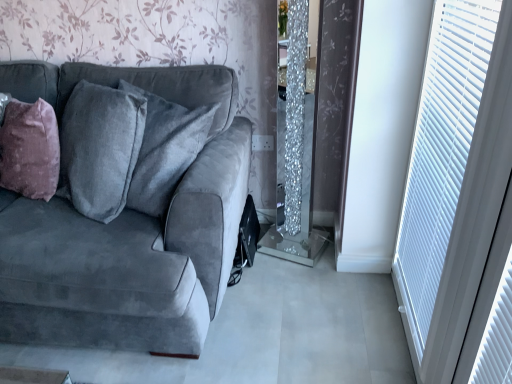
This screenshot has height=384, width=512. I want to click on white plastic blinds at right, so click(455, 175).

The height and width of the screenshot is (384, 512). I want to click on mauve velvet throw pillow at left, so click(x=30, y=149).

Is velvet gray couch at left taller than mauve velvet throw pillow at left?

Yes.

From the picture: From the image's perspective, which is below, velvet gray couch at left or mauve velvet throw pillow at left?

velvet gray couch at left.

Could you tell me if velvet gray couch at left is turned towards mauve velvet throw pillow at left?

No, velvet gray couch at left is not turned towards mauve velvet throw pillow at left.

From a real-world perspective, relative to mauve velvet throw pillow at left, is velvet gray couch at left vertically above or below?

velvet gray couch at left is below mauve velvet throw pillow at left.

Locate an element on the screen. This screenshot has width=512, height=384. studio couch on the left side of white plastic blinds at right is located at coordinates (127, 232).

From the picture: Is white plastic blinds at right at the left side of velvet gray couch at left?

Incorrect, white plastic blinds at right is not on the left side of velvet gray couch at left.

Based on their sizes in the image, would you say white plastic blinds at right is bigger or smaller than velvet gray couch at left?

In the image, white plastic blinds at right appears to be smaller than velvet gray couch at left.

Can you tell me how much white plastic blinds at right and velvet gray couch at left differ in facing direction?

There is a 88.9-degree angle between the facing directions of white plastic blinds at right and velvet gray couch at left.

Relative to velvet gray couch at left, is mauve velvet throw pillow at left in front or behind?

Clearly, mauve velvet throw pillow at left is behind velvet gray couch at left.

Considering the relative sizes of mauve velvet throw pillow at left and velvet gray couch at left in the image provided, is mauve velvet throw pillow at left shorter than velvet gray couch at left?

Yes.

How different are the orientations of mauve velvet throw pillow at left and velvet gray couch at left in degrees?

0.492 degrees separate the facing orientations of mauve velvet throw pillow at left and velvet gray couch at left.

Considering the positions of objects white plastic blinds at right and mauve velvet throw pillow at left in the image provided, who is more to the right, white plastic blinds at right or mauve velvet throw pillow at left?

Positioned to the right is white plastic blinds at right.

Is white plastic blinds at right facing towards mauve velvet throw pillow at left?

Yes, white plastic blinds at right is turned towards mauve velvet throw pillow at left.

Does point (502, 30) come closer to viewer compared to point (18, 154)?

Yes, point (502, 30) is in front of point (18, 154).

Is mauve velvet throw pillow at left completely or partially inside white plastic blinds at right?

Definitely not — mauve velvet throw pillow at left is not inside white plastic blinds at right.

Does mauve velvet throw pillow at left contain white plastic blinds at right?

No, white plastic blinds at right is located outside of mauve velvet throw pillow at left.

From the image's perspective, is mauve velvet throw pillow at left above or below white plastic blinds at right?

mauve velvet throw pillow at left is above white plastic blinds at right.

Locate an element on the screen. throw pillow directly beneath the white plastic blinds at right (from a real-world perspective) is located at coordinates (30, 149).

From a real-world perspective, is velvet gray couch at left located higher than white plastic blinds at right?

Actually, velvet gray couch at left is physically below white plastic blinds at right in the real world.

How far apart are velvet gray couch at left and white plastic blinds at right?

velvet gray couch at left and white plastic blinds at right are 35.95 inches apart.

What's the angular difference between velvet gray couch at left and white plastic blinds at right's facing directions?

88.9 degrees separate the facing orientations of velvet gray couch at left and white plastic blinds at right.

Does velvet gray couch at left have a greater width compared to white plastic blinds at right?

Yes, velvet gray couch at left is wider than white plastic blinds at right.

This screenshot has height=384, width=512. Find the location of `studio couch below the mauve velvet throw pillow at left (from a real-world perspective)`. studio couch below the mauve velvet throw pillow at left (from a real-world perspective) is located at coordinates (127, 232).

In order to click on window positioned vertically above the velvet gray couch at left (from a real-world perspective) in this screenshot , I will do `click(455, 175)`.

In the scene shown: Considering their positions, is velvet gray couch at left positioned closer to mauve velvet throw pillow at left than white plastic blinds at right?

Based on the image, velvet gray couch at left appears to be nearer to mauve velvet throw pillow at left.

Considering their positions, is mauve velvet throw pillow at left positioned closer to velvet gray couch at left than white plastic blinds at right?

The object closer to velvet gray couch at left is mauve velvet throw pillow at left.

Which object lies nearer to the anchor point white plastic blinds at right, mauve velvet throw pillow at left or velvet gray couch at left?

velvet gray couch at left.

When comparing their distances from white plastic blinds at right, does velvet gray couch at left or mauve velvet throw pillow at left seem further?

mauve velvet throw pillow at left is further to white plastic blinds at right.

From the image, which object appears to be farther from velvet gray couch at left, white plastic blinds at right or mauve velvet throw pillow at left?

white plastic blinds at right is positioned further to the anchor velvet gray couch at left.

Which object lies further to the anchor point mauve velvet throw pillow at left, white plastic blinds at right or velvet gray couch at left?

white plastic blinds at right.

Where is `studio couch between mauve velvet throw pillow at left and white plastic blinds at right from left to right`? Image resolution: width=512 pixels, height=384 pixels. studio couch between mauve velvet throw pillow at left and white plastic blinds at right from left to right is located at coordinates (127, 232).